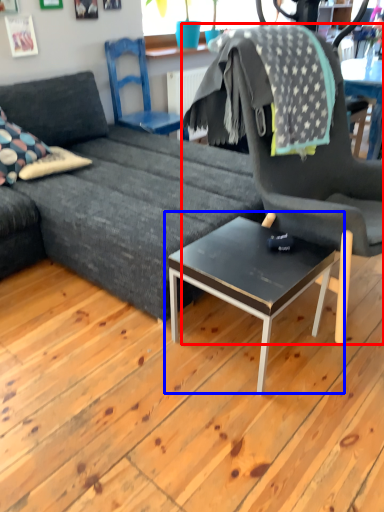
Question: Which object is further to the camera taking this photo, chair (highlighted by a red box) or coffee table (highlighted by a blue box)?

Choices:
 (A) chair
 (B) coffee table

Answer: (B)